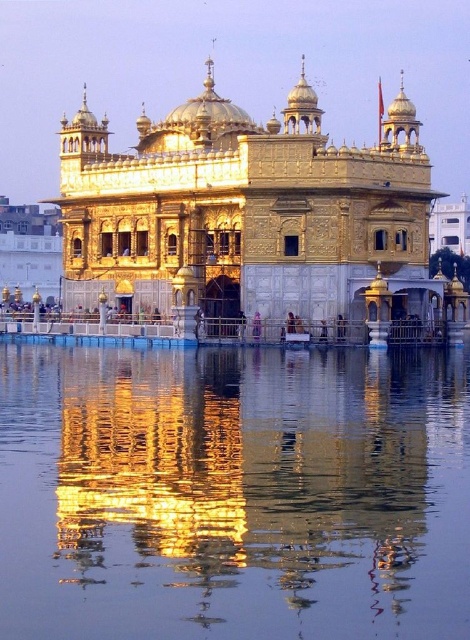
You are standing in front of the Golden Temple and want to take a photo of the temple and its reflection. Where should you position yourself to ensure the reflection of the temple is fully visible in the transparent liquid water at center?

You should position yourself at point (234, 493) to ensure the reflection of the temple is fully visible in the transparent liquid water at center.

You are standing at the Golden Temple and want to take a photo of the reflection of the temple in the water. The temple is at the center of the image. Where should you aim your camera to capture the reflection? Please provide the coordinates as a point in the format of point followed by coordinates in parentheses, like point (234, 493).

The transparent liquid water at center is represented by point (234, 493), so you should aim your camera at point (234, 493) to capture the reflection of the temple in the water.